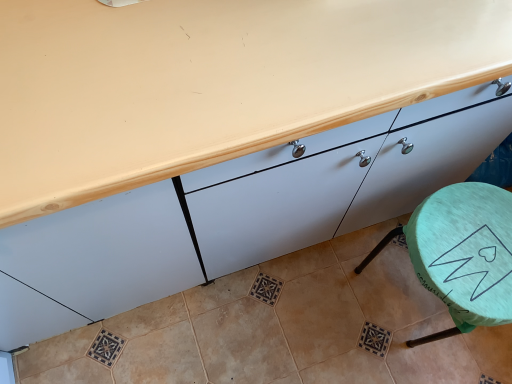
This screenshot has width=512, height=384. In order to click on vacant space to the left of green fabric stool at lower right in this screenshot , I will do `click(329, 304)`.